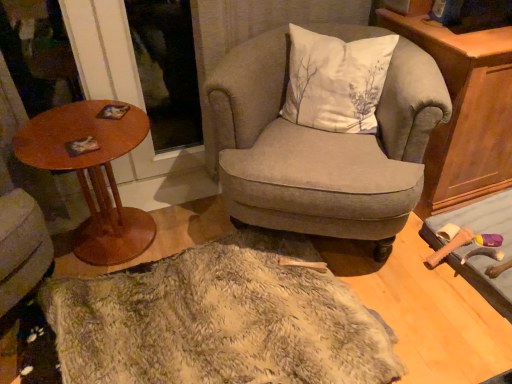
Question: Does point (140, 248) appear closer or farther from the camera than point (402, 206)?

Choices:
 (A) farther
 (B) closer

Answer: (A)

Question: Looking at the image, does wooden round table at left seem bigger or smaller compared to textured gray armchair at center?

Choices:
 (A) big
 (B) small

Answer: (B)

Question: Considering the real-world distances, which object is closest to the white cotton cushion at center?

Choices:
 (A) fuzzy beige rug at center
 (B) textured gray armchair at center
 (C) wooden cabinet at right
 (D) wooden round table at left

Answer: (B)

Question: Which object is the closest to the white cotton cushion at center?

Choices:
 (A) fuzzy beige rug at center
 (B) wooden round table at left
 (C) textured gray armchair at center
 (D) wooden cabinet at right

Answer: (C)